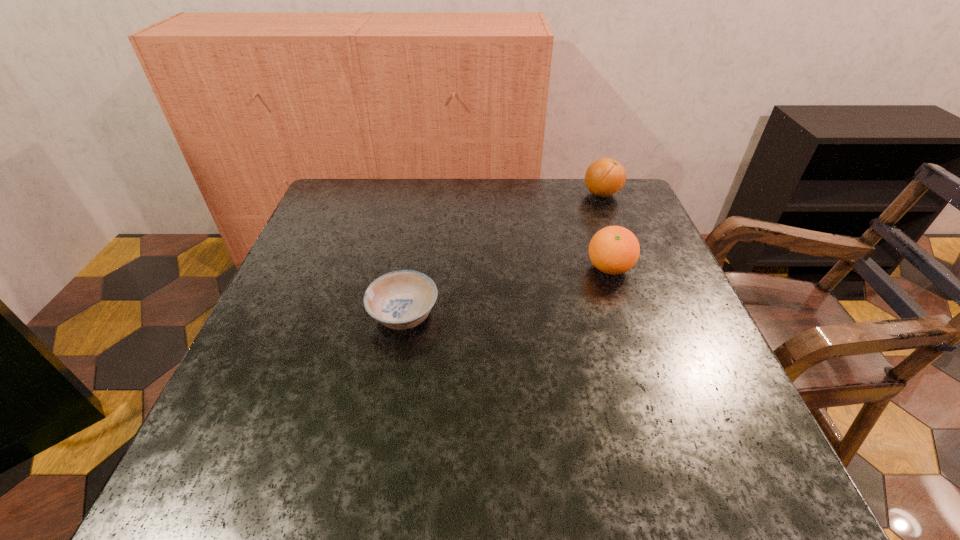
The image size is (960, 540). In the image, there is a desktop. Identify the location of vacant space at the near edge. (435, 464).

Image resolution: width=960 pixels, height=540 pixels. Find the location of `vacant area at the left edge of the desktop`. vacant area at the left edge of the desktop is located at coordinates (245, 386).

Identify the location of free space at the right edge of the desktop. This screenshot has height=540, width=960. (642, 362).

Image resolution: width=960 pixels, height=540 pixels. What are the coordinates of `vacant space at the far left corner` in the screenshot? It's located at (327, 200).

Where is `free spot at the far right corner of the desktop`? free spot at the far right corner of the desktop is located at coordinates (589, 210).

Identify the location of free space between the nearest object and the second farthest object. (507, 292).

The height and width of the screenshot is (540, 960). Find the location of `free area in between the leftmost object and the farther orange`. free area in between the leftmost object and the farther orange is located at coordinates (503, 255).

Find the location of a particular element. The image size is (960, 540). free spot between the farthest object and the leftmost object is located at coordinates [x=503, y=255].

This screenshot has height=540, width=960. Find the location of `empty space between the bowl and the farther orange`. empty space between the bowl and the farther orange is located at coordinates (503, 255).

Locate an element on the screen. vacant area that lies between the nearest object and the second nearest object is located at coordinates (507, 292).